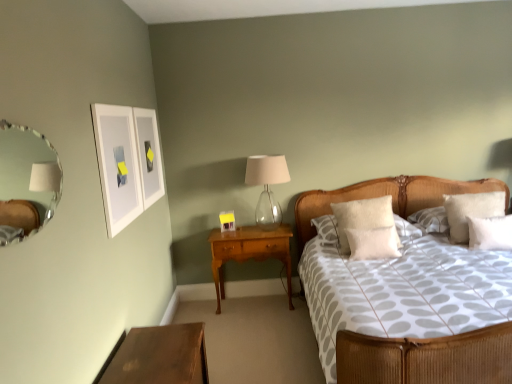
Locate an element on the screen. empty space that is ontop of wooden nightstand at center, positioned as the first nightstand in right-to-left order (from a real-world perspective) is located at coordinates (262, 229).